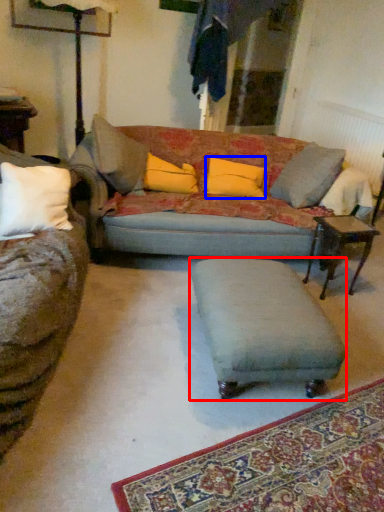
Question: Which point is closer to the camera, footrest (highlighted by a red box) or pillow (highlighted by a blue box)?

Choices:
 (A) footrest
 (B) pillow

Answer: (A)